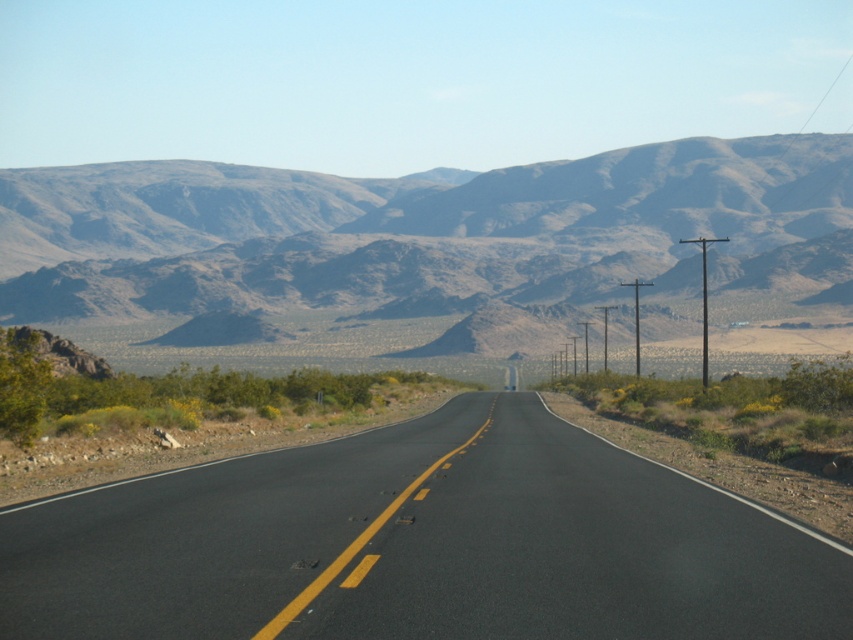
You are a driver approaching the black asphalt road at center and the brown rocky mountain range at upper center. Which of the two takes up more visual space in the image?

The brown rocky mountain range at upper center occupies more visual space than the black asphalt road at center.

You are standing at the point marked by the coordinates point (421, 545). Looking towards the road, which direction should you walk to reach the black asphalt road at center?

The point (421, 545) is already located on the black asphalt road at center, so you are already on the road.

You are driving along the black asphalt road at center and want to reach the brown rocky mountain range at upper center. Which direction should you turn to get closer to the mountain range?

You should turn to the left because the black asphalt road at center is to the right of the brown rocky mountain range at upper center, so turning left would align you towards the mountain range.